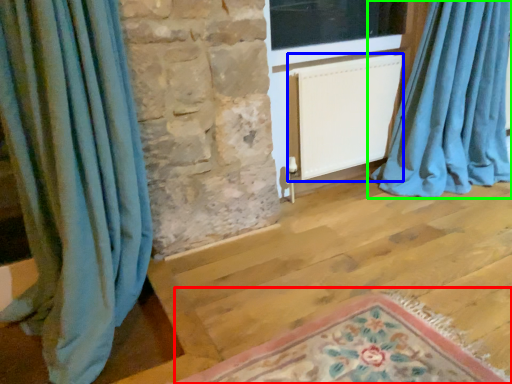
Question: Which is nearer to the mat (highlighted by a red box)? radiator (highlighted by a blue box) or curtain (highlighted by a green box).

Choices:
 (A) radiator
 (B) curtain

Answer: (A)